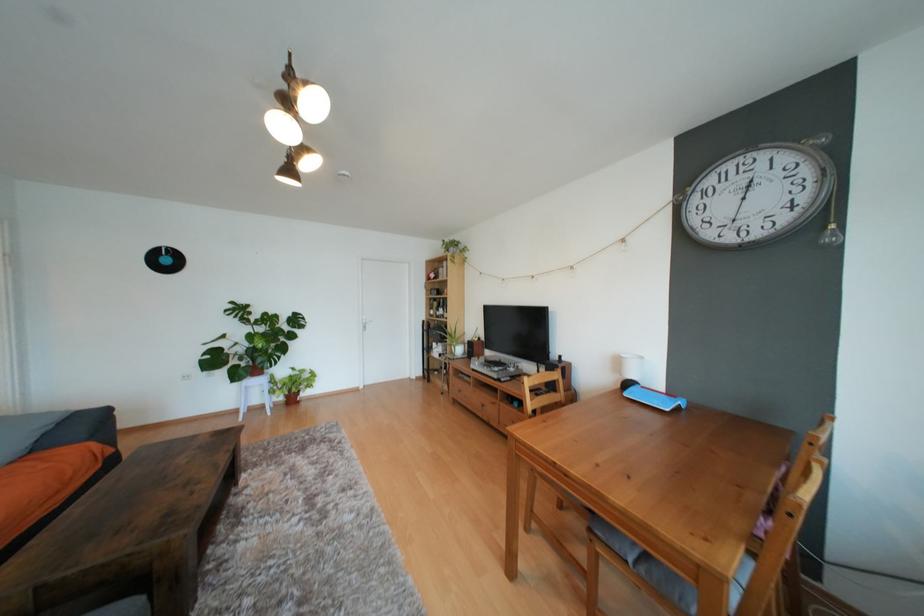
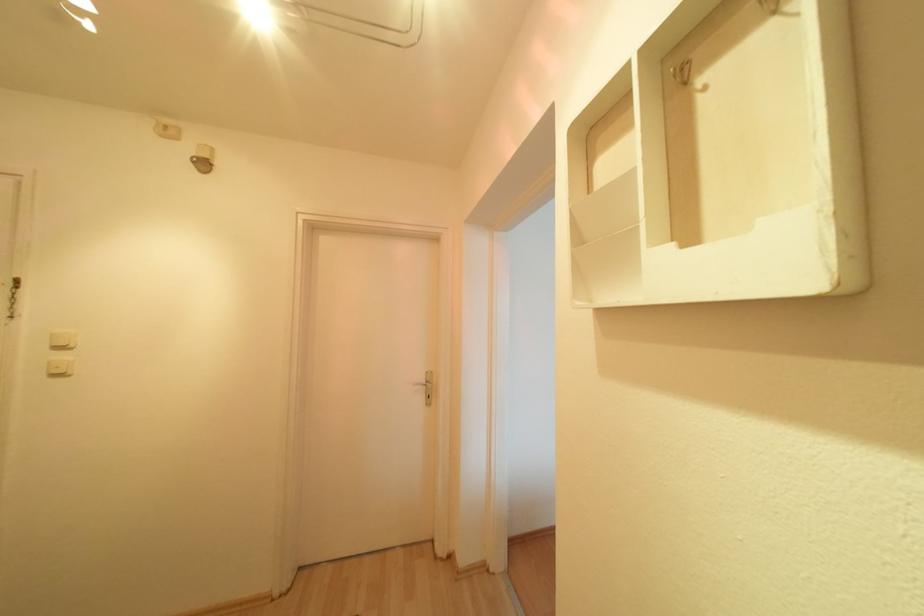
Question: What movement of the cameraman would produce the second image?

Choices:
 (A) Left
 (B) Right
 (C) Forward
 (D) Backward

Answer: (A)